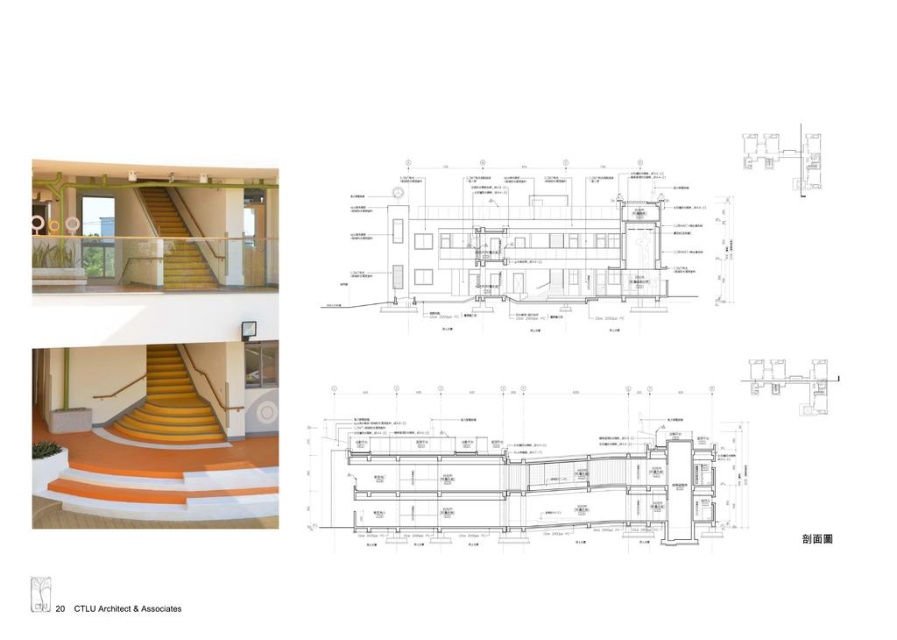
Question: Which point is closer to the camera?

Choices:
 (A) (197, 264)
 (B) (176, 436)

Answer: (A)

Question: Which of the following is the closest to the observer?

Choices:
 (A) (147, 420)
 (B) (176, 230)

Answer: (A)

Question: Is orange carpeted stairs at center below yellow matte/stained wood stairs at upper center?

Choices:
 (A) no
 (B) yes

Answer: (B)

Question: Is orange carpeted stairs at center bigger than yellow matte/stained wood stairs at upper center?

Choices:
 (A) no
 (B) yes

Answer: (A)

Question: Is orange carpeted stairs at center wider than yellow matte/stained wood stairs at upper center?

Choices:
 (A) yes
 (B) no

Answer: (B)

Question: Among these points, which one is nearest to the camera?

Choices:
 (A) (150, 352)
 (B) (196, 252)

Answer: (B)